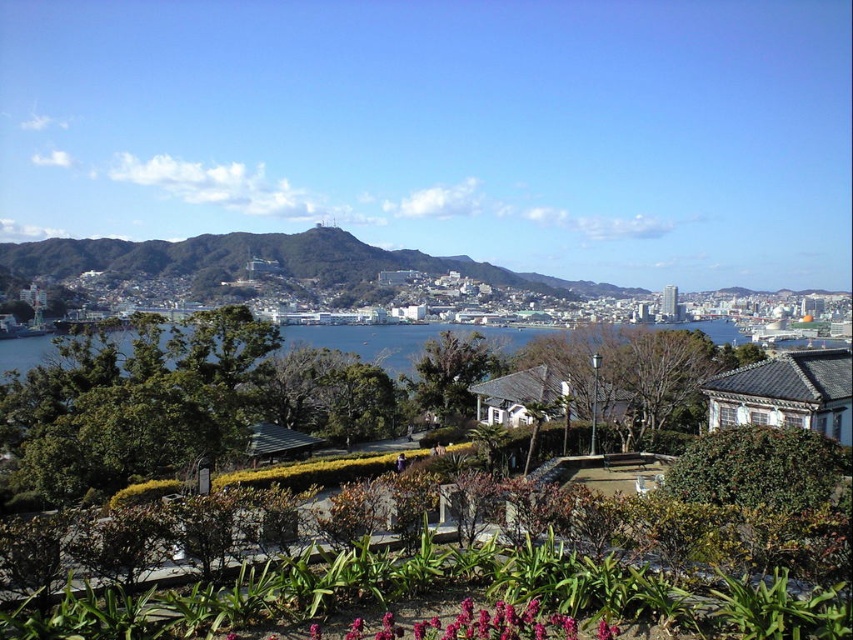
Question: Does green leafy garden at lower center have a larger size compared to green grassy hill at center?

Choices:
 (A) no
 (B) yes

Answer: (A)

Question: Is green leafy garden at lower center positioned in front of green grassy hill at center?

Choices:
 (A) yes
 (B) no

Answer: (A)

Question: Which point is farther from the camera taking this photo?

Choices:
 (A) (154, 241)
 (B) (834, 600)

Answer: (A)

Question: Which of the following is the closest to the observer?

Choices:
 (A) (534, 284)
 (B) (721, 513)

Answer: (B)

Question: Can you confirm if green leafy garden at lower center is positioned above green grassy hill at center?

Choices:
 (A) yes
 (B) no

Answer: (B)

Question: Which object is closer to the camera taking this photo?

Choices:
 (A) green leafy garden at lower center
 (B) green grassy hill at center

Answer: (A)